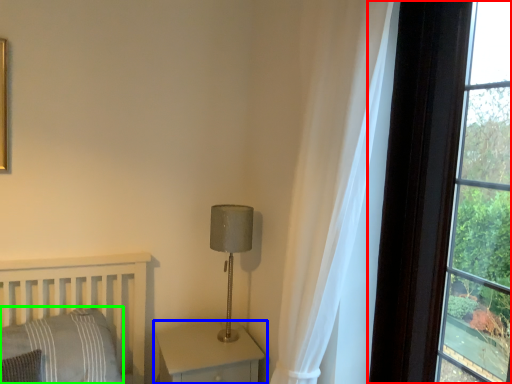
Question: Which is nearer to the window (highlighted by a red box)? nightstand (highlighted by a blue box) or pillow (highlighted by a green box).

Choices:
 (A) nightstand
 (B) pillow

Answer: (A)